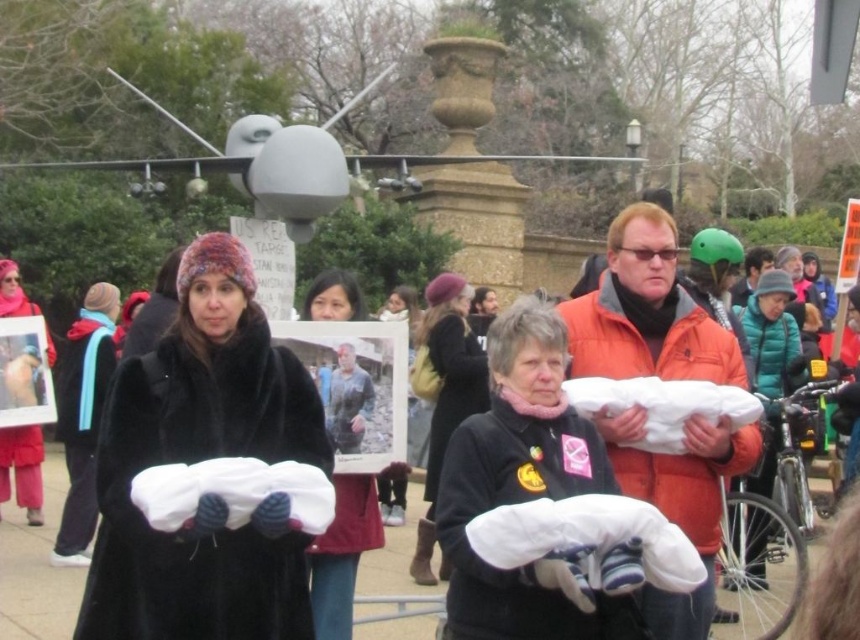
In the scene shown: Can you confirm if black fur coat at center is positioned above black wool coat at center?

Actually, black fur coat at center is below black wool coat at center.

Does point (244, 627) come behind point (477, 403)?

No, (244, 627) is in front of (477, 403).

This screenshot has height=640, width=860. In order to click on black fur coat at center in this screenshot , I will do `click(200, 461)`.

Which of these two, black fur coat at center or white cotton shirt at center, stands shorter?

black fur coat at center is shorter.

Based on the photo, can you confirm if black fur coat at center is bigger than white cotton shirt at center?

Yes, black fur coat at center is bigger than white cotton shirt at center.

Measure the distance between point (x=95, y=637) and camera.

They are 79.06 feet apart.

I want to click on black fur coat at center, so click(x=200, y=461).

Can you confirm if black fur coat at center is positioned above velvet red coat at center?

Actually, black fur coat at center is below velvet red coat at center.

Which is behind, point (88, 580) or point (0, 444)?

The point (0, 444) is behind.

Is point (250, 387) positioned before point (34, 433)?

Yes, point (250, 387) is in front of point (34, 433).

The image size is (860, 640). I want to click on black fur coat at center, so point(200,461).